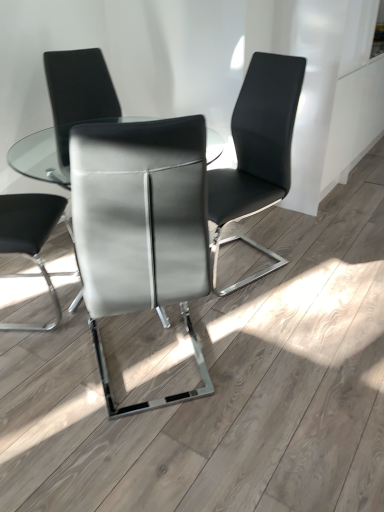
Question: In the image, is satin gray leather chair at center, marked as the second chair in a right-to-left arrangement, positioned in front of or behind clear glass table at center?

Choices:
 (A) front
 (B) behind

Answer: (A)

Question: Is satin gray leather chair at center, marked as the second chair in a right-to-left arrangement, wider or thinner than clear glass table at center?

Choices:
 (A) wide
 (B) thin

Answer: (B)

Question: Which of these objects is positioned farthest from the clear glass table at center?

Choices:
 (A) satin gray leather chair at center, marked as the second chair in a right-to-left arrangement
 (B) sleek leather chair at center, placed as the first chair when sorted from left to right
 (C) matte black chair at center, placed as the 3th chair when sorted from left to right

Answer: (A)

Question: Based on their relative distances, which object is farther from the clear glass table at center?

Choices:
 (A) sleek leather chair at center, which is the third chair from right to left
 (B) satin gray leather chair at center, marked as the second chair in a right-to-left arrangement
 (C) matte black chair at center, placed as the 3th chair when sorted from left to right

Answer: (B)